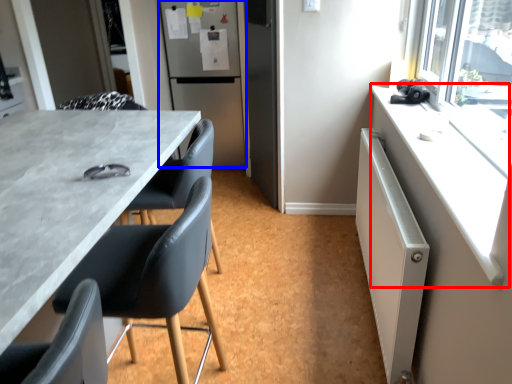
Question: Which object appears closest to the camera in this image, counter top (highlighted by a red box) or refrigerator (highlighted by a blue box)?

Choices:
 (A) counter top
 (B) refrigerator

Answer: (A)